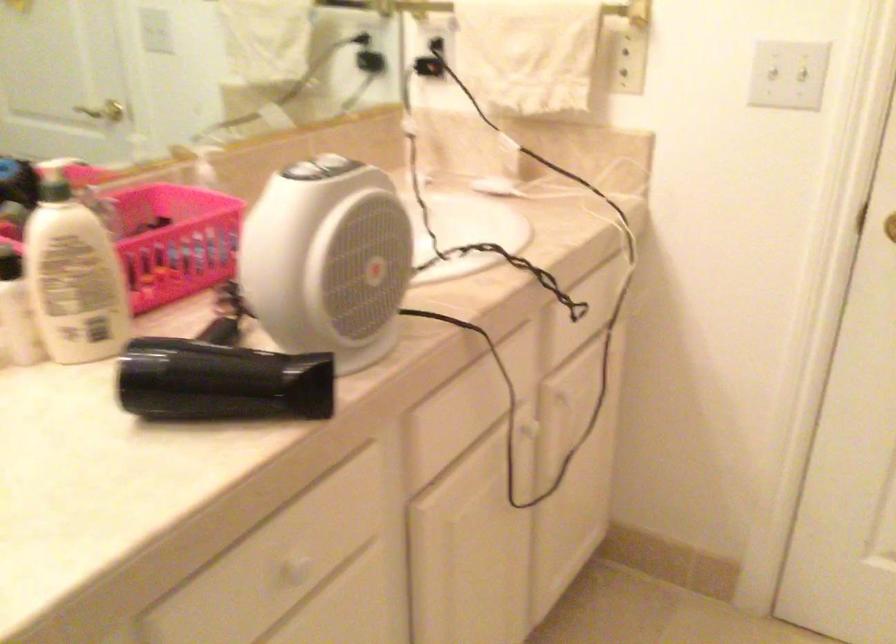
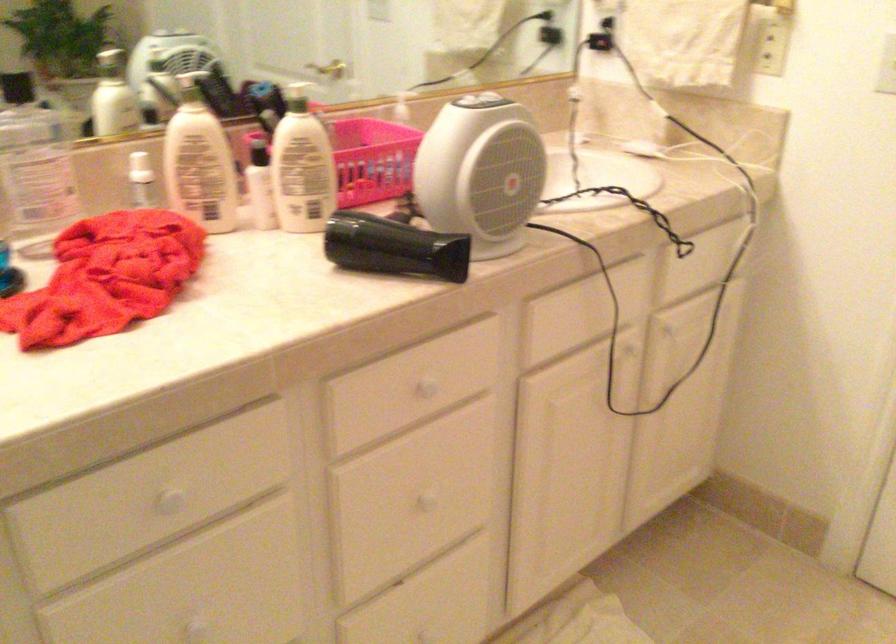
The point at (x=312, y=558) is marked in the first image. Where is the corresponding point in the second image?

(426, 386)